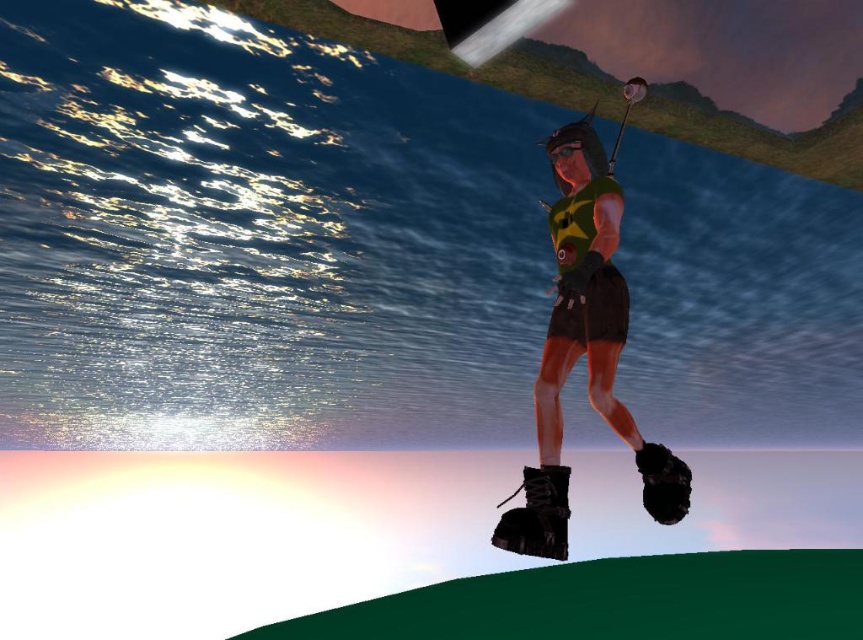
You are a character in the game who needs to retrieve an item from the black leather baseball glove at lower right. Since you are currently standing on the shiny black boots at center, can you reach the glove without moving your feet?

The shiny black boots at center is in front of the black leather baseball glove at lower right, so the glove is behind your current position. You can reach it by bending or stretching your arm backward without moving your feet.